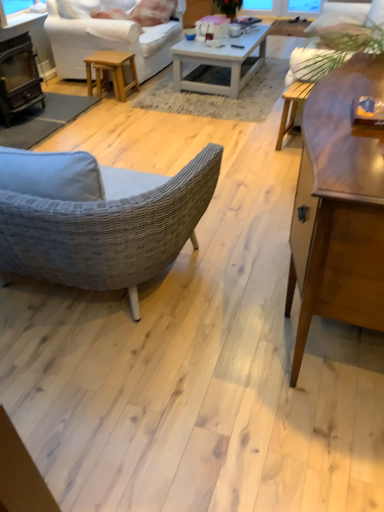
Question: Is wooden coffee table at center, which appears as the 1th coffee table when ordered from the bottom, to the left or to the right of white cotton pillow at upper center in the image?

Choices:
 (A) right
 (B) left

Answer: (A)

Question: Is wooden coffee table at center, the first coffee table positioned from the front, inside the boundaries of white cotton pillow at upper center, or outside?

Choices:
 (A) outside
 (B) inside

Answer: (A)

Question: Which of these objects is positioned closest to the white fabric couch at upper center?

Choices:
 (A) light brown wooden stool at center
 (B) white fabric studio couch at upper left
 (C) white glossy coffee table at center, the second coffee table when ordered from front to back
 (D) wooden coffee table at center, the 2th coffee table in the top-to-bottom sequence
 (E) black cast iron fireplace at left

Answer: (C)

Question: Which object is positioned closest to the white cotton pillow at upper center?

Choices:
 (A) white glossy coffee table at center, which is counted as the 1th coffee table, starting from the back
 (B) white fabric studio couch at upper left
 (C) wooden coffee table at center, the 2th coffee table in the top-to-bottom sequence
 (D) black cast iron fireplace at left
 (E) white fabric couch at upper center

Answer: (B)